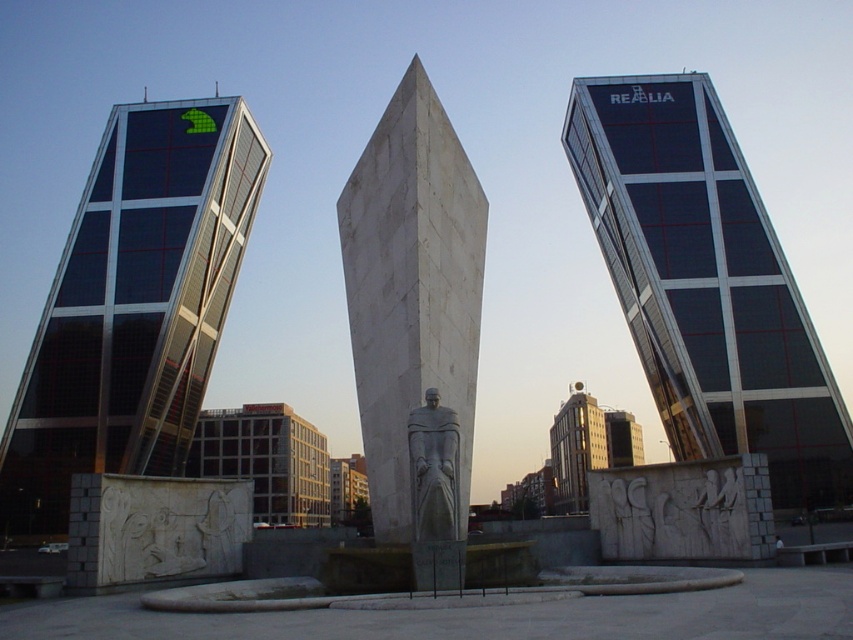
Who is shorter, dark glass skyscraper at center or glassy black skyscraper at left?

dark glass skyscraper at center

Is dark glass skyscraper at center closer to the viewer compared to glassy black skyscraper at left?

Yes, dark glass skyscraper at center is closer to the viewer.

Image resolution: width=853 pixels, height=640 pixels. I want to click on dark glass skyscraper at center, so click(706, 284).

Can you confirm if dark glass skyscraper at center is positioned above gray stone statue at center?

Correct, dark glass skyscraper at center is located above gray stone statue at center.

From the picture: Is dark glass skyscraper at center positioned at the back of gray stone statue at center?

That is True.

What do you see at coordinates (706, 284) in the screenshot? The image size is (853, 640). I see `dark glass skyscraper at center` at bounding box center [706, 284].

At what (x,y) coordinates should I click in order to perform the action: click on dark glass skyscraper at center. Please return your answer as a coordinate pair (x, y). The height and width of the screenshot is (640, 853). Looking at the image, I should click on (706, 284).

Does glassy black skyscraper at left have a lesser height compared to gray stone statue at center?

Incorrect, glassy black skyscraper at left's height does not fall short of gray stone statue at center's.

Image resolution: width=853 pixels, height=640 pixels. Find the location of `glassy black skyscraper at left`. glassy black skyscraper at left is located at coordinates 132,305.

Is point (171, 467) less distant than point (433, 493)?

No, (171, 467) is further to viewer.

I want to click on glassy black skyscraper at left, so click(132, 305).